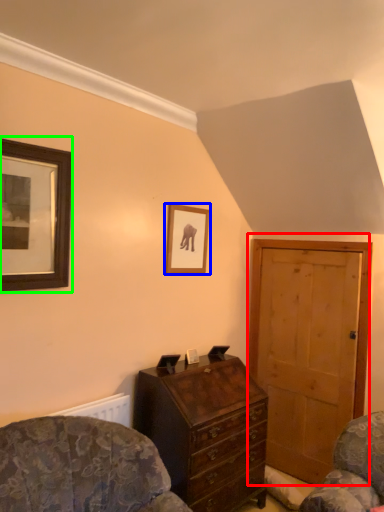
Question: Which is nearer to the door (highlighted by a red box)? picture frame (highlighted by a blue box) or picture frame (highlighted by a green box).

Choices:
 (A) picture frame
 (B) picture frame

Answer: (A)